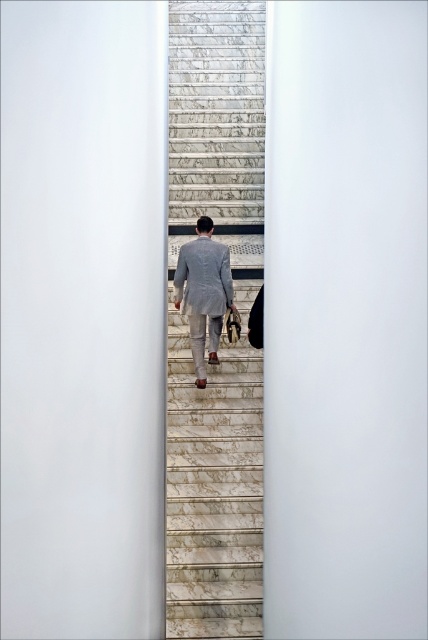
You are standing at the bottom of the marble stairs at center and want to reach the top. The light gray suit at center is blocking your path. Can you go around them?

The marble stairs at center are closer to you than the light gray suit at center, so you can move around the light gray suit at center by stepping aside on the stairs since the stairs are in front of the person.

You are a delivery person standing at the bottom of the marble stairs at center. You need to hand over a package to the person wearing the light gray suit at center. Can you reach them without climbing the stairs?

The marble stairs at center and light gray suit at center are 4.33 feet apart from each other. Since the distance is relatively short, you might be able to reach them by extending your arm or using a tool like a stick, but physically handing over the package without climbing the stairs may be challenging due to the stairs creating a vertical barrier.